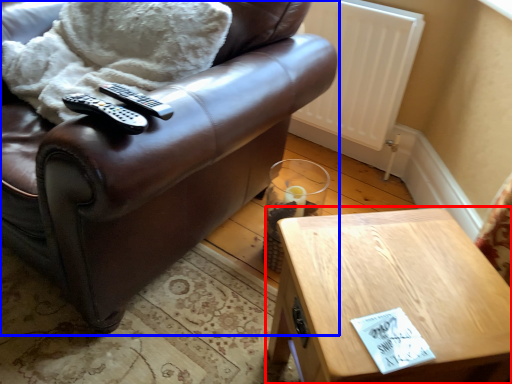
Question: Which object appears closest to the camera in this image, table (highlighted by a red box) or chair (highlighted by a blue box)?

Choices:
 (A) table
 (B) chair

Answer: (B)